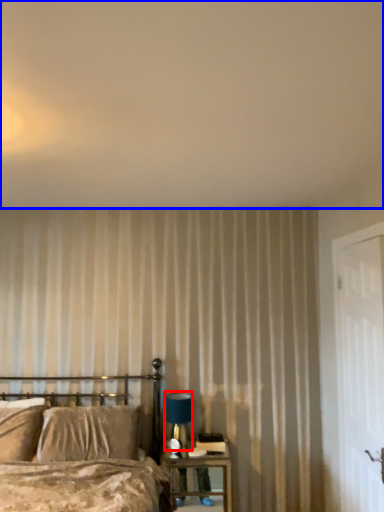
Question: Which point is closer to the camera, table lamp (highlighted by a red box) or backdrop (highlighted by a blue box)?

Choices:
 (A) table lamp
 (B) backdrop

Answer: (B)